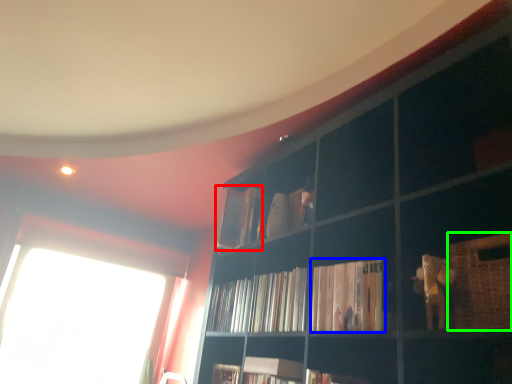
Question: Based on their relative distances, which object is nearer to book (highlighted by a red box)? Choose from book (highlighted by a blue box) and basket (highlighted by a green box).

Choices:
 (A) book
 (B) basket

Answer: (A)